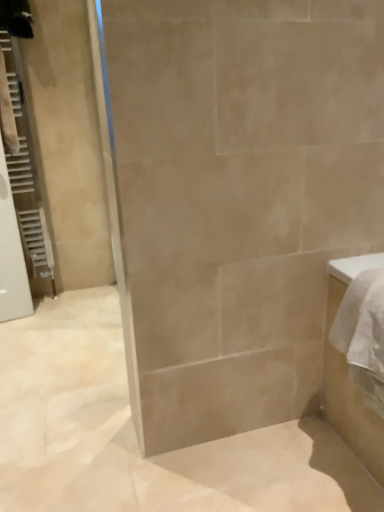
Question: From the image's perspective, does white textured radiator at left appear higher than white glossy cabinet at right?

Choices:
 (A) no
 (B) yes

Answer: (B)

Question: Does white textured radiator at left have a larger size compared to white glossy cabinet at right?

Choices:
 (A) no
 (B) yes

Answer: (A)

Question: Can you confirm if white textured radiator at left is wider than white glossy cabinet at right?

Choices:
 (A) no
 (B) yes

Answer: (A)

Question: From a real-world perspective, is white textured radiator at left located higher than white glossy cabinet at right?

Choices:
 (A) no
 (B) yes

Answer: (B)

Question: Is white textured radiator at left looking in the opposite direction of white glossy cabinet at right?

Choices:
 (A) no
 (B) yes

Answer: (A)

Question: Is white textured radiator at left closer to the viewer compared to white glossy cabinet at right?

Choices:
 (A) no
 (B) yes

Answer: (A)

Question: Is white glossy cabinet at right not close to white textured radiator at left?

Choices:
 (A) yes
 (B) no

Answer: (A)

Question: From the image's perspective, is white glossy cabinet at right on white textured radiator at left?

Choices:
 (A) no
 (B) yes

Answer: (A)

Question: From the image's perspective, does white glossy cabinet at right appear lower than white textured radiator at left?

Choices:
 (A) yes
 (B) no

Answer: (A)

Question: Can you confirm if white glossy cabinet at right is shorter than white textured radiator at left?

Choices:
 (A) no
 (B) yes

Answer: (B)

Question: Does white glossy cabinet at right have a greater width compared to white textured radiator at left?

Choices:
 (A) no
 (B) yes

Answer: (B)

Question: Is white glossy cabinet at right directly adjacent to white textured radiator at left?

Choices:
 (A) yes
 (B) no

Answer: (B)

Question: Do you think white textured radiator at left is within white glossy cabinet at right, or outside of it?

Choices:
 (A) inside
 (B) outside

Answer: (B)